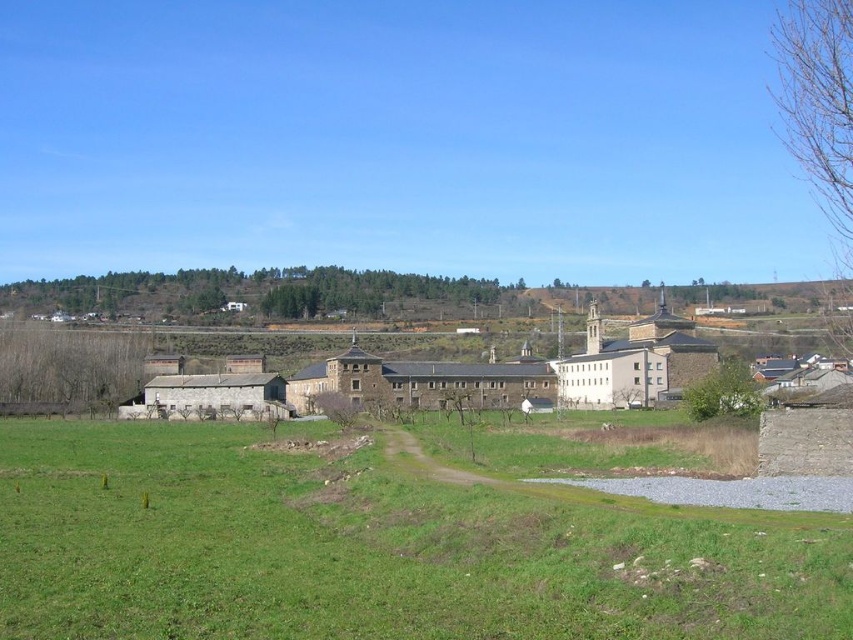
Question: Is green grass at lower left closer to camera compared to stone building at center?

Choices:
 (A) yes
 (B) no

Answer: (A)

Question: Which point is closer to the camera?

Choices:
 (A) green grass at lower left
 (B) stone building at center

Answer: (A)

Question: Among these points, which one is nearest to the camera?

Choices:
 (A) (566, 384)
 (B) (389, 474)

Answer: (B)

Question: Can you confirm if green grass at lower left is positioned below stone building at center?

Choices:
 (A) no
 (B) yes

Answer: (B)

Question: Can you confirm if green grass at lower left is bigger than stone building at center?

Choices:
 (A) yes
 (B) no

Answer: (B)